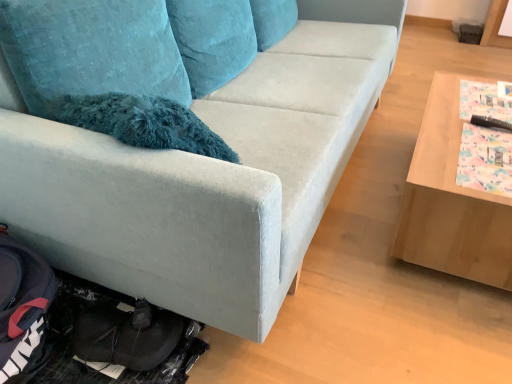
What is the approximate width of velvet blue couch at center?

It is 1.08 meters.

What do you see at coordinates (208, 175) in the screenshot? I see `velvet blue couch at center` at bounding box center [208, 175].

Identify the location of velvet blue couch at center. (208, 175).

I want to click on light brown wooden table at right, so click(x=451, y=201).

The width and height of the screenshot is (512, 384). What do you see at coordinates (451, 201) in the screenshot?
I see `light brown wooden table at right` at bounding box center [451, 201].

What are the coordinates of `velvet blue couch at center` in the screenshot? It's located at (208, 175).

Is light brown wooden table at right at the right side of velvet blue couch at center?

Yes, light brown wooden table at right is to the right of velvet blue couch at center.

Is light brown wooden table at right further to camera compared to velvet blue couch at center?

Yes.

Which is behind, point (457, 200) or point (315, 152)?

Positioned behind is point (315, 152).

From the image's perspective, which is below, light brown wooden table at right or velvet blue couch at center?

light brown wooden table at right.

From a real-world perspective, which object rests below the other?

light brown wooden table at right, from a real-world perspective.

Which of these two, light brown wooden table at right or velvet blue couch at center, is thinner?

Thinner between the two is light brown wooden table at right.

Who is taller, light brown wooden table at right or velvet blue couch at center?

velvet blue couch at center.

Is light brown wooden table at right smaller than velvet blue couch at center?

Yes.

Is light brown wooden table at right inside the boundaries of velvet blue couch at center, or outside?

light brown wooden table at right is not enclosed by velvet blue couch at center.

Is there a large distance between light brown wooden table at right and velvet blue couch at center?

No.

Is light brown wooden table at right facing away from velvet blue couch at center?

Absolutely, light brown wooden table at right is directed away from velvet blue couch at center.

Identify the location of table behind the velvet blue couch at center. This screenshot has height=384, width=512. (451, 201).

Is velvet blue couch at center to the left of light brown wooden table at right from the viewer's perspective?

Yes.

Considering the relative positions of velvet blue couch at center and light brown wooden table at right in the image provided, is velvet blue couch at center behind light brown wooden table at right?

No, velvet blue couch at center is closer to the viewer.

Is point (189, 215) farther from viewer compared to point (504, 272)?

No, (189, 215) is closer to viewer.

From the image's perspective, is velvet blue couch at center under light brown wooden table at right?

No.

From a real-world perspective, is velvet blue couch at center over light brown wooden table at right?

Indeed, from a real-world perspective, velvet blue couch at center stands above light brown wooden table at right.

Is velvet blue couch at center wider than light brown wooden table at right?

Yes, velvet blue couch at center is wider than light brown wooden table at right.

Who is shorter, velvet blue couch at center or light brown wooden table at right?

light brown wooden table at right is shorter.

Can you confirm if velvet blue couch at center is smaller than light brown wooden table at right?

No, velvet blue couch at center is not smaller than light brown wooden table at right.

Would you say velvet blue couch at center is outside light brown wooden table at right?

That's correct, velvet blue couch at center is outside of light brown wooden table at right.

Is velvet blue couch at center directly adjacent to light brown wooden table at right?

No, velvet blue couch at center is not next to light brown wooden table at right.

Could you tell me if velvet blue couch at center is facing light brown wooden table at right?

Yes, velvet blue couch at center is facing light brown wooden table at right.

Locate an element on the screen. The width and height of the screenshot is (512, 384). table that appears on the right of velvet blue couch at center is located at coordinates (451, 201).

There is a light brown wooden table at right. Find the location of `studio couch above it (from a real-world perspective)`. studio couch above it (from a real-world perspective) is located at coordinates (208, 175).

This screenshot has height=384, width=512. What are the coordinates of `studio couch located above the light brown wooden table at right (from the image's perspective)` in the screenshot? It's located at (208, 175).